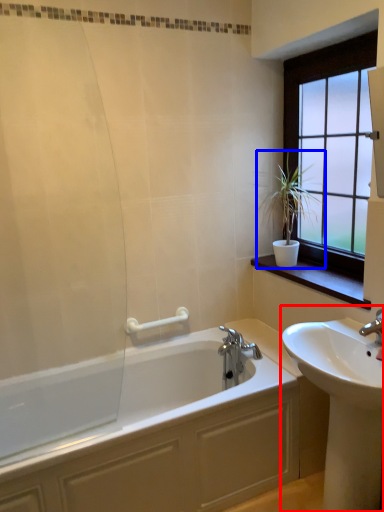
Question: Which of the following is the farthest to the observer, sink (highlighted by a red box) or houseplant (highlighted by a blue box)?

Choices:
 (A) sink
 (B) houseplant

Answer: (B)